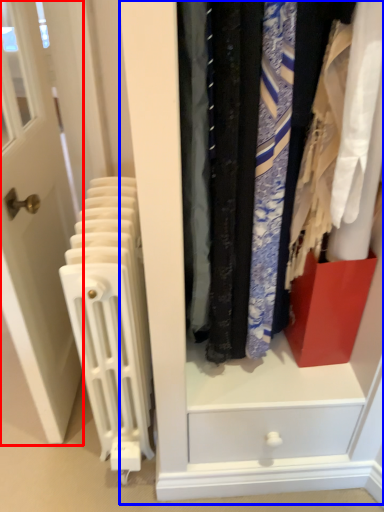
Question: Which point is further to the camera, door (highlighted by a red box) or dresser (highlighted by a blue box)?

Choices:
 (A) door
 (B) dresser

Answer: (A)